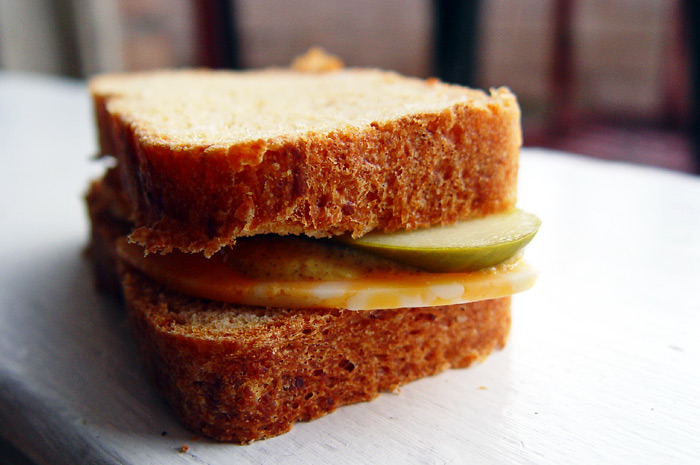
Where is `bathroom sign`? bathroom sign is located at coordinates (153, 47).